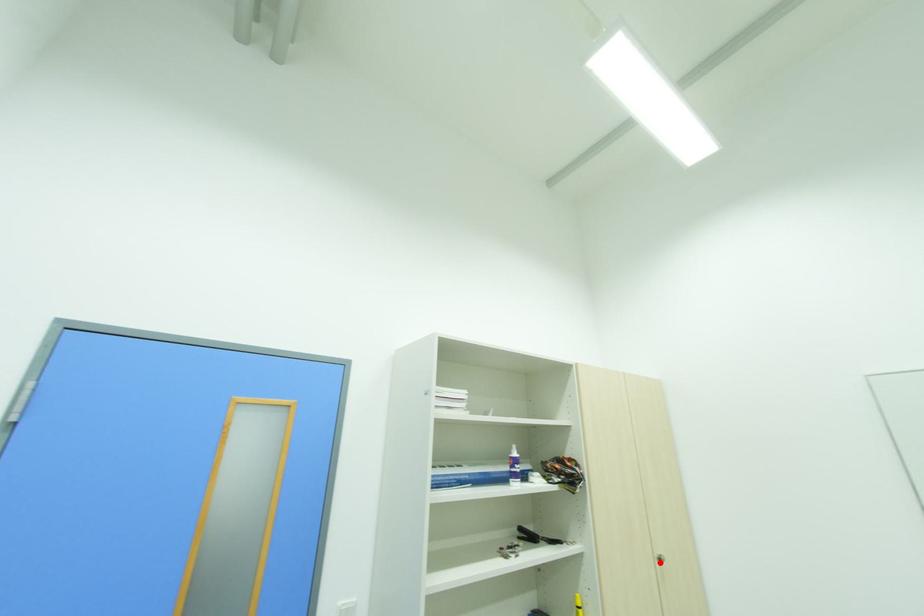
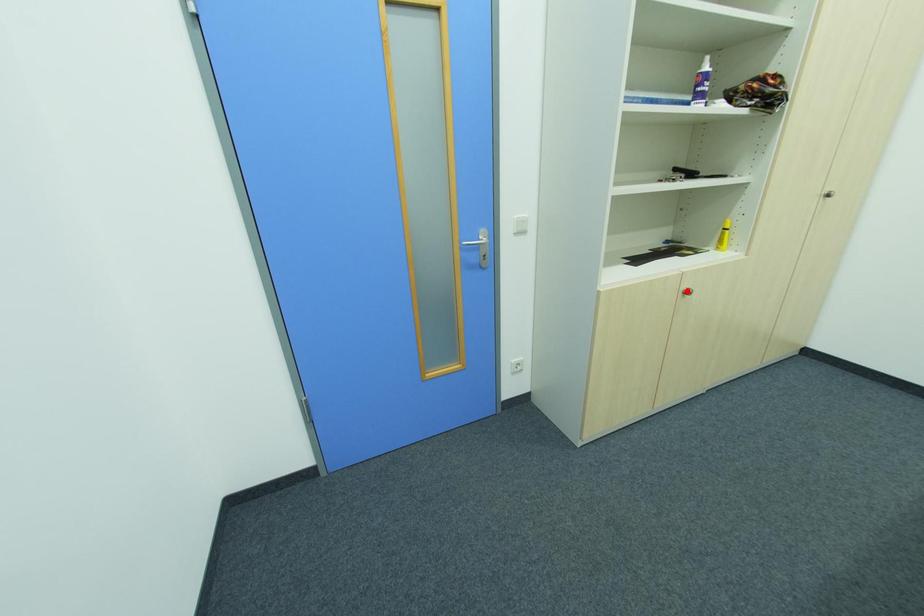
I am providing you with two images of the same scene from different viewpoints. A red point is marked on the first image and another point is marked on the second image. Is the red point in image1 aligned with the point shown in image2?

No